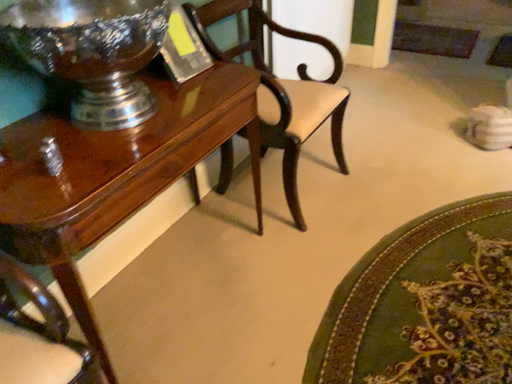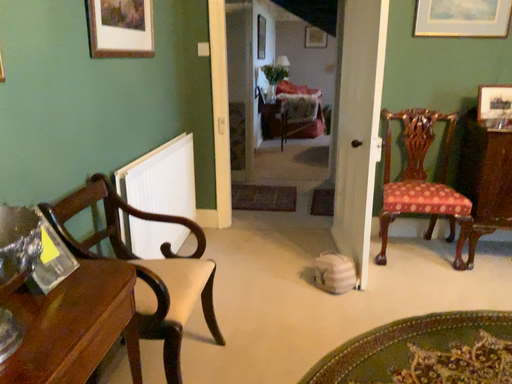
Question: Which way did the camera rotate in the video?

Choices:
 (A) rotated downward
 (B) rotated upward

Answer: (B)